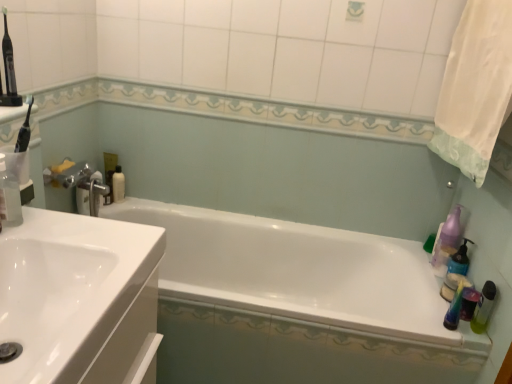
Locate an element on the screen. This screenshot has height=384, width=512. vacant area that is situated to the right of transparent plastic bottle at left, the 1th cleaning product when ordered from left to right is located at coordinates (60, 229).